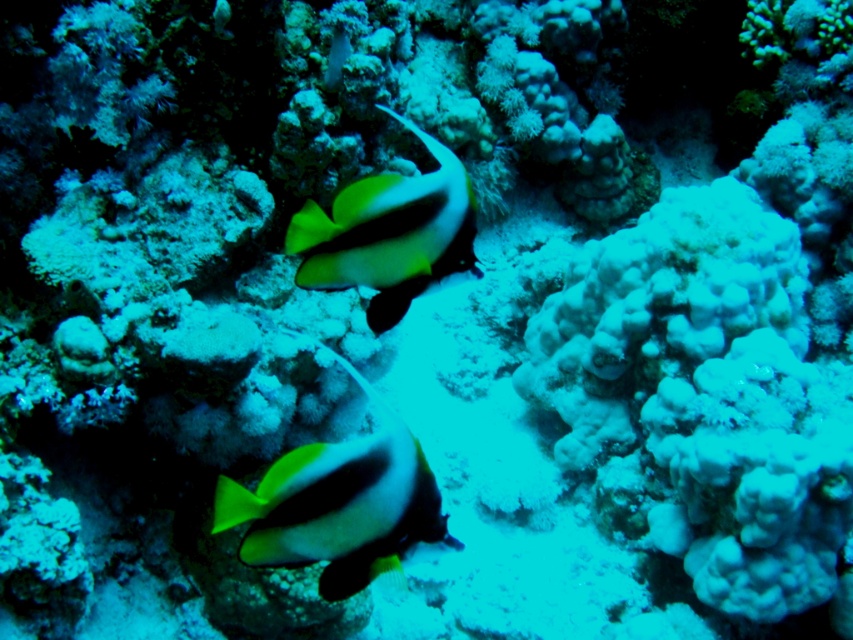
Question: Is the position of neon green matte fish at center more distant than that of black matte fish at center?

Choices:
 (A) no
 (B) yes

Answer: (A)

Question: Can you confirm if neon green matte fish at center is positioned to the left of black matte fish at center?

Choices:
 (A) yes
 (B) no

Answer: (A)

Question: Which object is farther from the camera taking this photo?

Choices:
 (A) neon green matte fish at center
 (B) black matte fish at center

Answer: (B)

Question: Which point appears farthest from the camera in this image?

Choices:
 (A) (302, 518)
 (B) (459, 260)

Answer: (B)

Question: Can you confirm if neon green matte fish at center is positioned to the right of black matte fish at center?

Choices:
 (A) yes
 (B) no

Answer: (B)